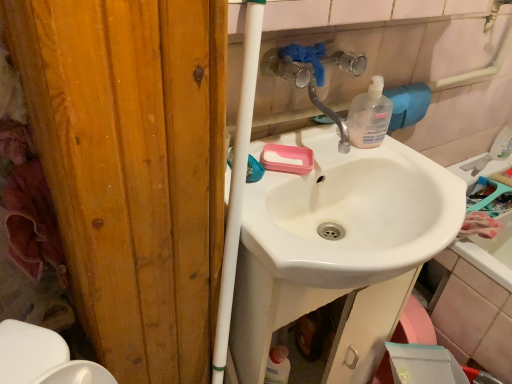
Where is `vacant space to the right of pink matte soap at center`? The width and height of the screenshot is (512, 384). vacant space to the right of pink matte soap at center is located at coordinates (352, 154).